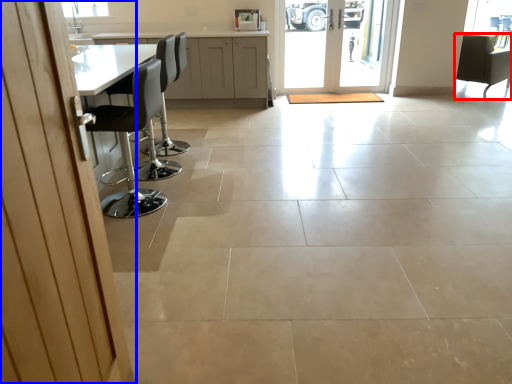
Question: Which object is closer to the camera taking this photo, chair (highlighted by a red box) or door (highlighted by a blue box)?

Choices:
 (A) chair
 (B) door

Answer: (B)